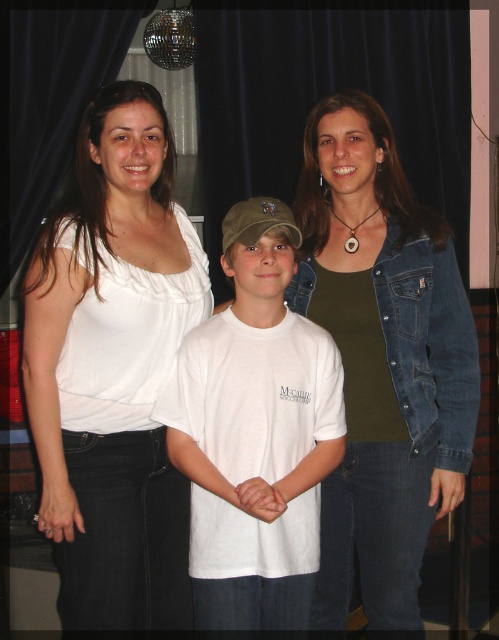
Question: Which object is positioned farthest from the denim jacket at right?

Choices:
 (A) white cotton blouse at upper left
 (B) white cotton t-shirt at center

Answer: (A)

Question: Which of the following is the farthest from the observer?

Choices:
 (A) (213, 326)
 (B) (73, 486)
 (C) (461, 400)

Answer: (C)

Question: Is denim jacket at right positioned at the back of white cotton t-shirt at center?

Choices:
 (A) no
 (B) yes

Answer: (B)

Question: Which is nearer to the white cotton blouse at upper left?

Choices:
 (A) white cotton t-shirt at center
 (B) denim jacket at right

Answer: (A)

Question: Is denim jacket at right positioned behind white cotton t-shirt at center?

Choices:
 (A) no
 (B) yes

Answer: (B)

Question: Considering the relative positions of white cotton blouse at upper left and denim jacket at right in the image provided, where is white cotton blouse at upper left located with respect to denim jacket at right?

Choices:
 (A) above
 (B) below

Answer: (A)